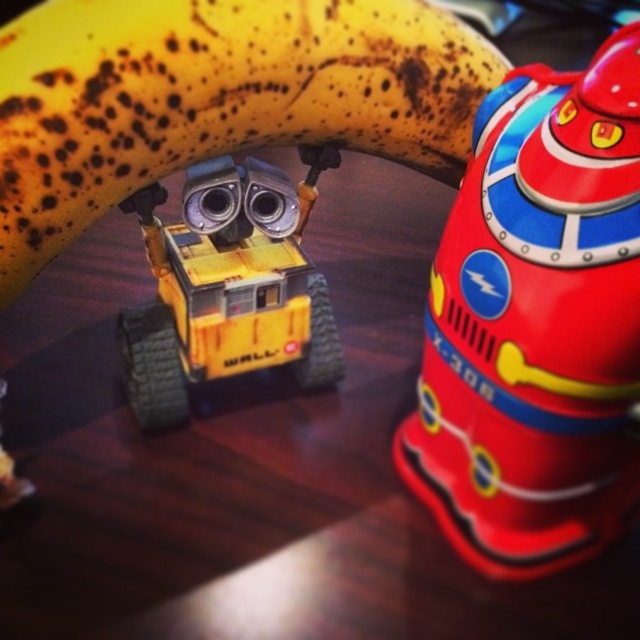
You are a child trying to reach the yellow spotted banana at upper center and the yellow matte robot at center. Which object is higher up?

The yellow spotted banana at upper center is higher up than the yellow matte robot at center.

You are looking at the image and want to know which of the two points, point (556, 312) or point (276, 362), is nearer to you. Can you tell me which one?

Point (556, 312) is closer to the viewer than point (276, 362).

You are a child trying to reach both the shiny plastic toy at upper right and the yellow spotted banana at upper center from where you are standing. Which object is closer to you?

The shiny plastic toy at upper right is 8.91 inches away from the yellow spotted banana at upper center, so the distance between them is 8.91 inches. However, without knowing your exact position, it is impossible to determine which one is closer to you.